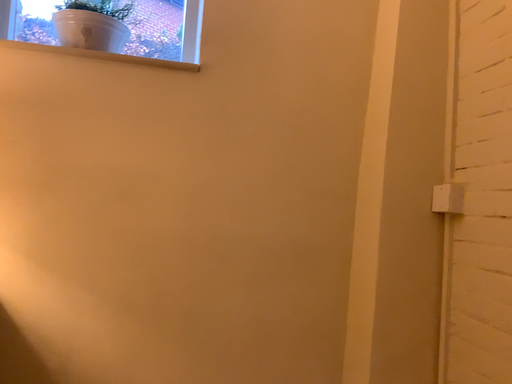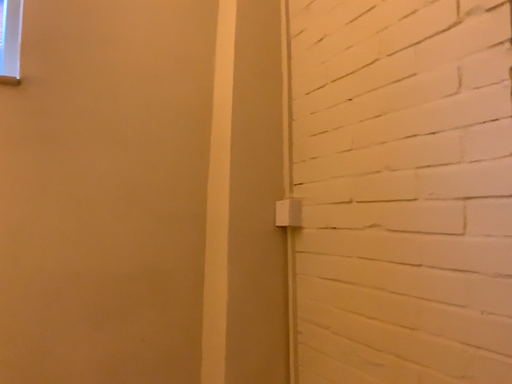
Question: How did the camera likely rotate when shooting the video?

Choices:
 (A) rotated right
 (B) rotated left

Answer: (A)